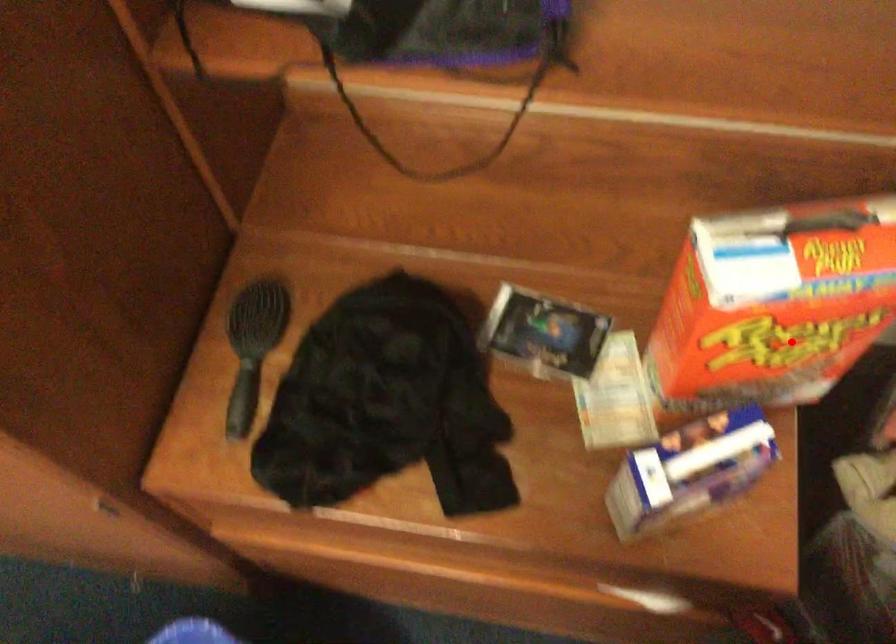
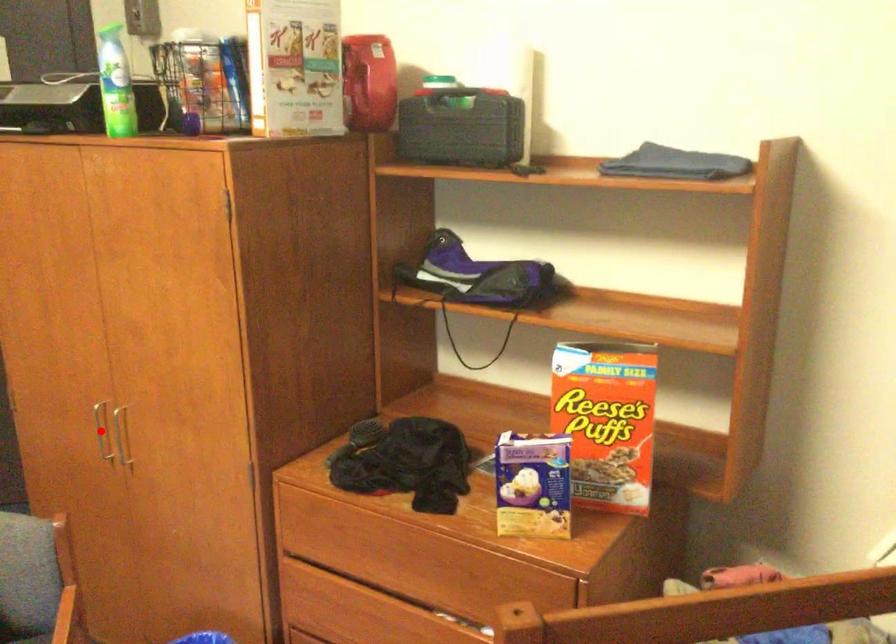
I am providing you with two images of the same scene from different viewpoints. A red point is marked on the first image and another point is marked on the second image. Are the points marked in image1 and image2 representing the same 3D position?

No